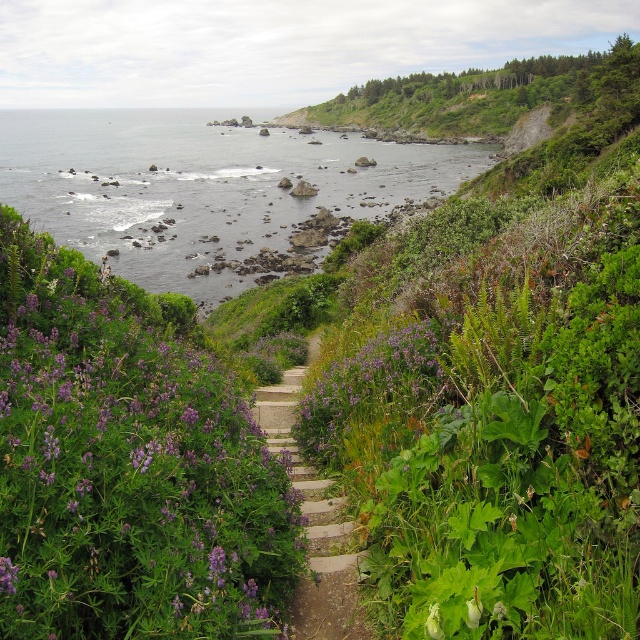
Can you confirm if purple soft-textured flowers at center-left is smaller than purple matte flower at center?

Incorrect, purple soft-textured flowers at center-left is not smaller in size than purple matte flower at center.

Which is above, purple soft-textured flowers at center-left or purple matte flower at center?

Positioned higher is purple soft-textured flowers at center-left.

Where is `purple soft-textured flowers at center-left`? The height and width of the screenshot is (640, 640). purple soft-textured flowers at center-left is located at coordinates (131, 476).

Which is in front, point (3, 499) or point (289, 145)?

Point (3, 499)

Does purple soft-textured flowers at center-left appear on the left side of clear water at upper center?

No, purple soft-textured flowers at center-left is not to the left of clear water at upper center.

Identify the location of purple soft-textured flowers at center-left. The height and width of the screenshot is (640, 640). (131, 476).

Can you confirm if clear water at upper center is shorter than purple matte flower at center?

In fact, clear water at upper center may be taller than purple matte flower at center.

Can you confirm if clear water at upper center is bigger than purple matte flower at center?

Indeed, clear water at upper center has a larger size compared to purple matte flower at center.

The image size is (640, 640). Describe the element at coordinates (202, 186) in the screenshot. I see `clear water at upper center` at that location.

Identify the location of clear water at upper center. (202, 186).